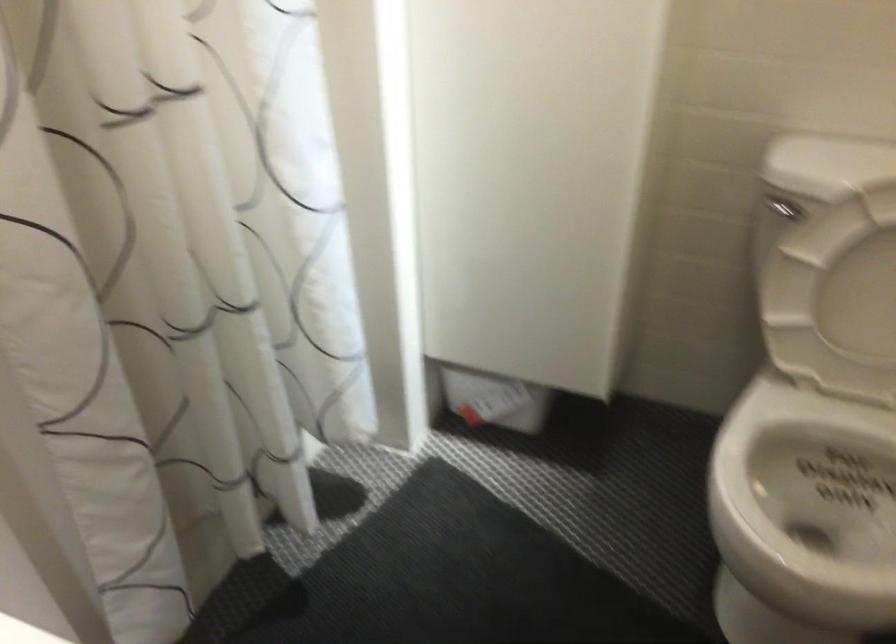
Identify the location of white toilet seat. (824, 491).